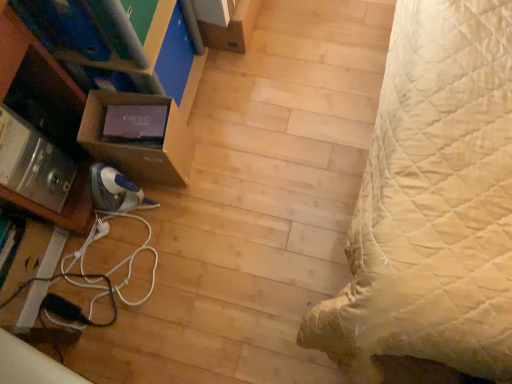
Question: Is matte black monitor at left to the left or to the right of brown cardboard box at left, placed as the 1th shelf when sorted from right to left, in the image?

Choices:
 (A) left
 (B) right

Answer: (A)

Question: Is point (183, 117) closer or farther from the camera than point (180, 157)?

Choices:
 (A) closer
 (B) farther

Answer: (B)

Question: Based on their relative distances, which object is farther from the metallic silver shelf at lower left, marked as the 2th shelf in a right-to-left arrangement?

Choices:
 (A) brown cardboard box at left, the 2th shelf positioned from the left
 (B) matte black monitor at left
 (C) white cord at lower left

Answer: (C)

Question: Based on their relative distances, which object is nearer to the white cord at lower left?

Choices:
 (A) metallic silver shelf at lower left, arranged as the first shelf when viewed from the left
 (B) brown cardboard box at left, the 2th shelf positioned from the left
 (C) matte black monitor at left

Answer: (B)